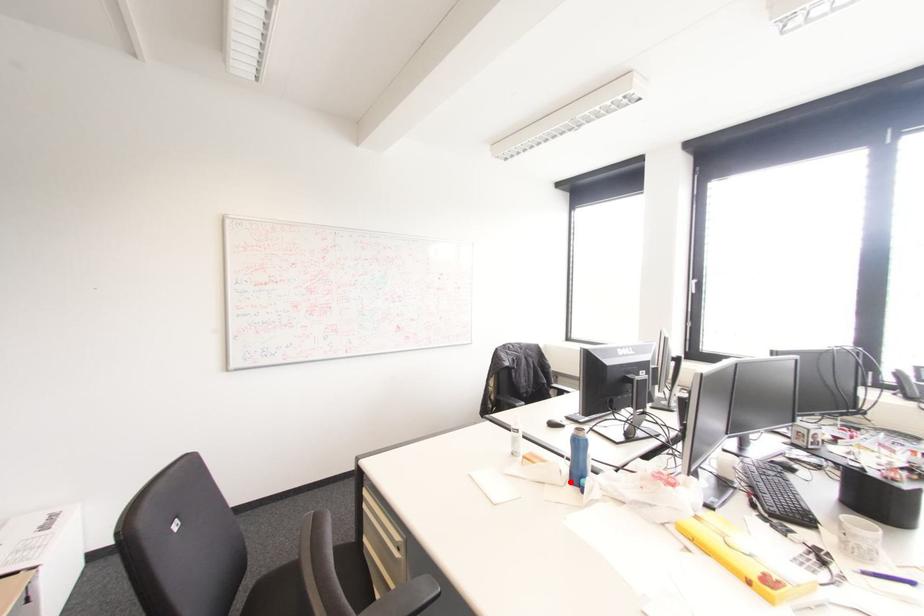
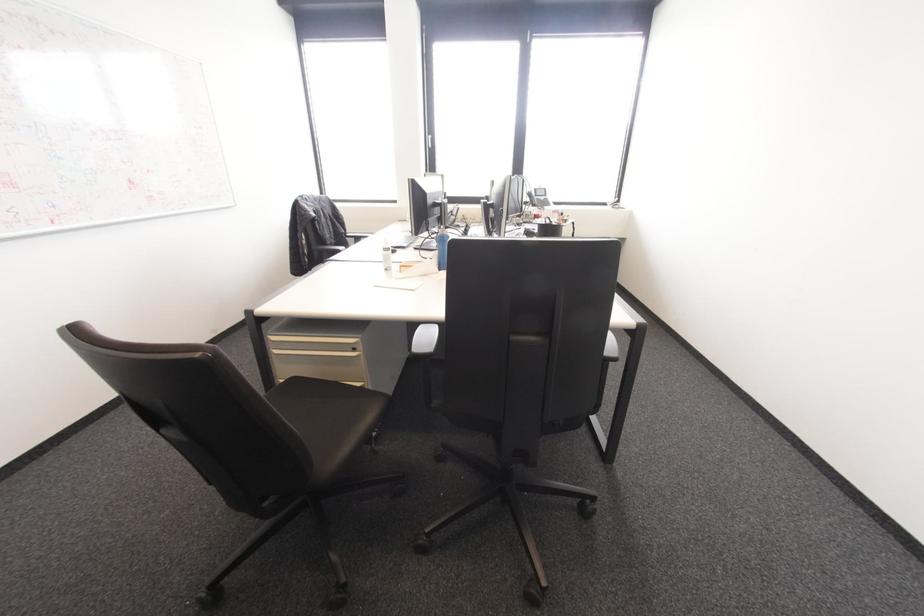
Question: I am providing you with two images of the same scene from different viewpoints. Given a red point in image1, look at the same physical point in image2. Is it:

Choices:
 (A) Closer to the viewpoint
 (B) Farther from the viewpoint

Answer: (A)